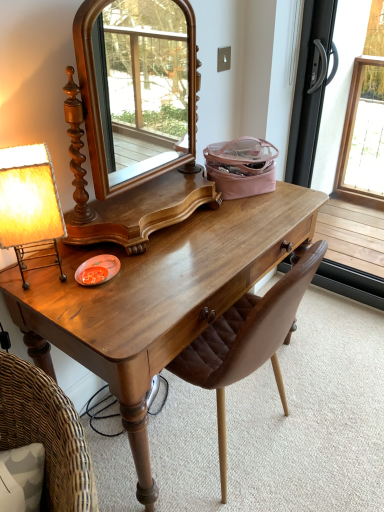
The width and height of the screenshot is (384, 512). In order to click on vacant area that is in front of matte yellow fabric lampshade at left in this screenshot , I will do `click(62, 305)`.